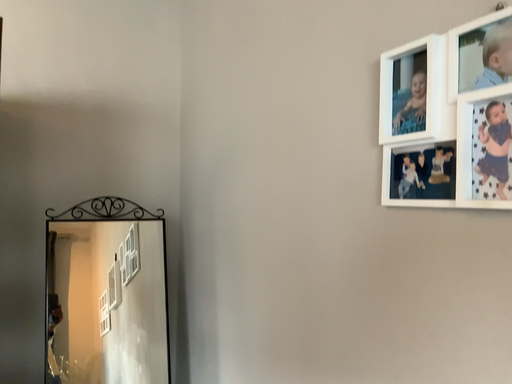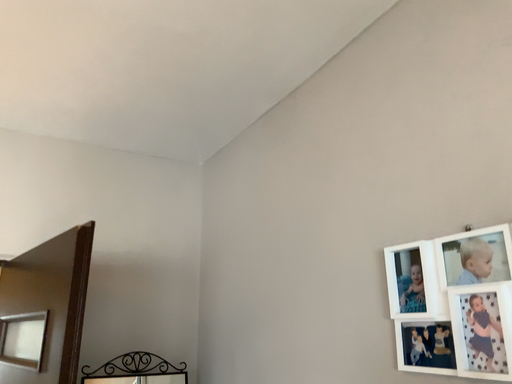
Question: How did the camera likely rotate when shooting the video?

Choices:
 (A) rotated upward
 (B) rotated downward

Answer: (A)